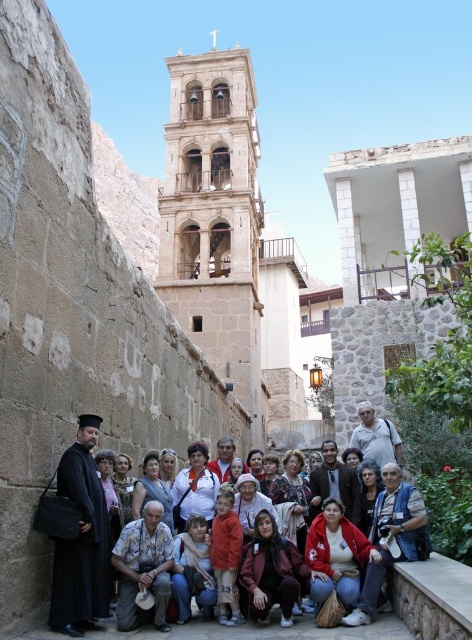
Question: Is the position of red fleece jacket at lower center more distant than that of dark blue fabric robe at center?

Choices:
 (A) yes
 (B) no

Answer: (A)

Question: Observing the image, what is the correct spatial positioning of black matte robe at left in reference to red fleece jacket at lower center?

Choices:
 (A) above
 (B) below

Answer: (B)

Question: Which point is farther to the camera?

Choices:
 (A) (258, 214)
 (B) (161, 572)
 (C) (95, 424)

Answer: (A)

Question: Considering the relative positions of stone bell tower at center and black matte robe at left in the image provided, where is stone bell tower at center located with respect to black matte robe at left?

Choices:
 (A) below
 (B) above

Answer: (B)

Question: Which of the following is the closest to the observer?

Choices:
 (A) black matte robe at left
 (B) dark red fabric robe at center

Answer: (A)

Question: Which point is farther to the camera?

Choices:
 (A) stone bell tower at center
 (B) dark brown leather jacket at center

Answer: (A)